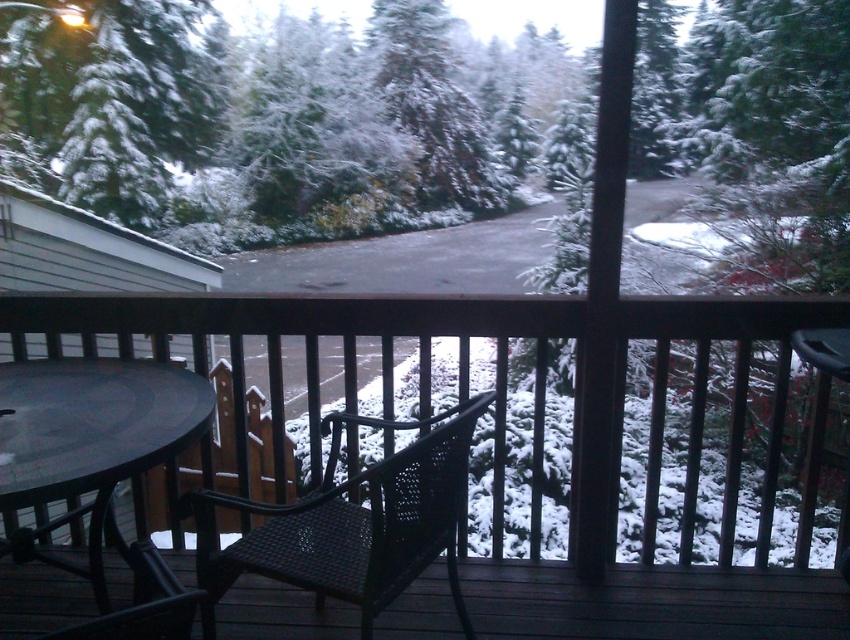
You are planning to host a small gathering on the deck and want to place a rectangular tray that is 1.2 meters wide on the space between the matte black chair at center and the black matte table at lower left. Can the tray fit horizontally between them?

The matte black chair at center is wider than the black matte table at lower left, but the exact dimensions of the space between them are not provided. Therefore, it is uncertain if the tray will fit horizontally between them.

You are planning to host a small gathering on the deck and need to seat two guests. There are two chairs available on the deck, a black mesh chair at center and a black wicker chair at center. Which chair would you choose if you want to accommodate both guests comfortably?

The black wicker chair at center is larger than the black mesh chair at center, so it would be more comfortable for seating two guests.